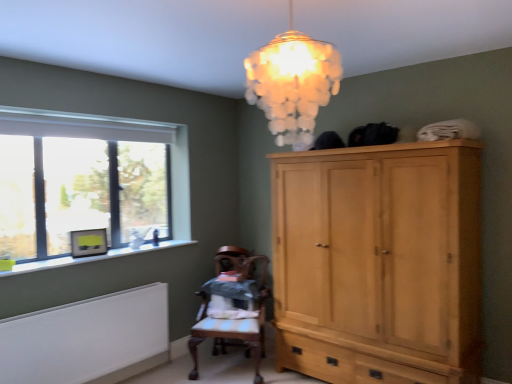
Question: From the image's perspective, is light wood cabinet at right located above or below translucent glass chandelier at upper center?

Choices:
 (A) above
 (B) below

Answer: (B)

Question: From a real-world perspective, relative to translucent glass chandelier at upper center, is light wood cabinet at right vertically above or below?

Choices:
 (A) below
 (B) above

Answer: (A)

Question: Which is nearer to the clear glass window at left?

Choices:
 (A) translucent glass chandelier at upper center
 (B) wooden chair at center
 (C) light wood cabinet at right
 (D) white painted radiator at lower left

Answer: (D)

Question: Which is nearer to the light wood cabinet at right?

Choices:
 (A) clear glass window at left
 (B) white painted radiator at lower left
 (C) translucent glass chandelier at upper center
 (D) wooden chair at center

Answer: (D)